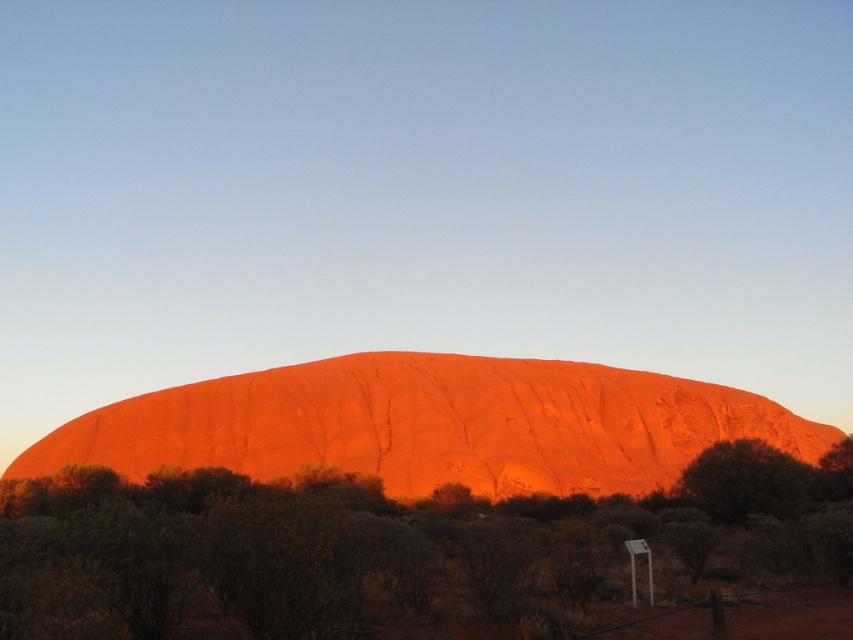
Question: Which point appears closest to the camera in this image?

Choices:
 (A) (730, 474)
 (B) (537, 484)
 (C) (62, 604)

Answer: (C)

Question: Can you confirm if green leafy shrub at center is bigger than green leafy bush at lower right?

Choices:
 (A) yes
 (B) no

Answer: (A)

Question: Can you confirm if green leafy shrub at center is wider than matte orange rock at center?

Choices:
 (A) no
 (B) yes

Answer: (A)

Question: Among these objects, which one is farthest from the camera?

Choices:
 (A) matte orange rock at center
 (B) green leafy shrub at center
 (C) green leafy bush at lower right

Answer: (A)

Question: Estimate the real-world distances between objects in this image. Which object is closer to the green leafy shrub at center?

Choices:
 (A) green leafy bush at lower right
 (B) matte orange rock at center

Answer: (A)

Question: Does green leafy shrub at center appear under green leafy bush at lower right?

Choices:
 (A) no
 (B) yes

Answer: (A)